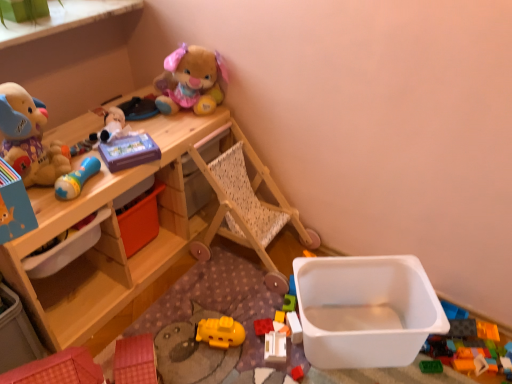
Identify the location of vacant space positioned to the left of fluffy plush rabbit at upper center, the 1th toy viewed from the top. (139, 111).